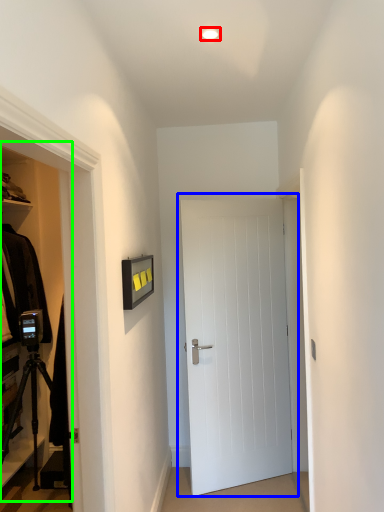
Question: Which object is positioned farthest from lighting (highlighted by a red box)? Select from door (highlighted by a blue box) and dresser (highlighted by a green box).

Choices:
 (A) door
 (B) dresser

Answer: (B)